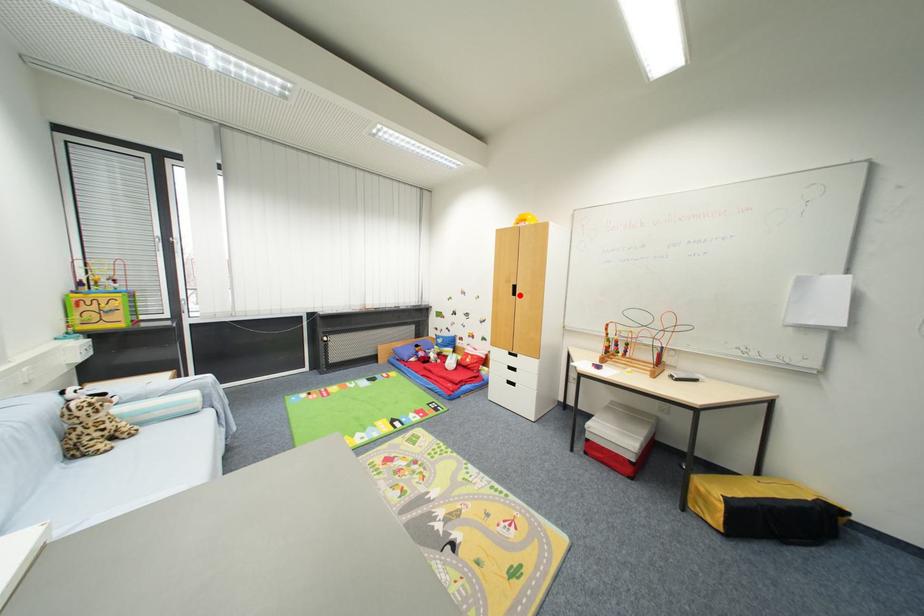
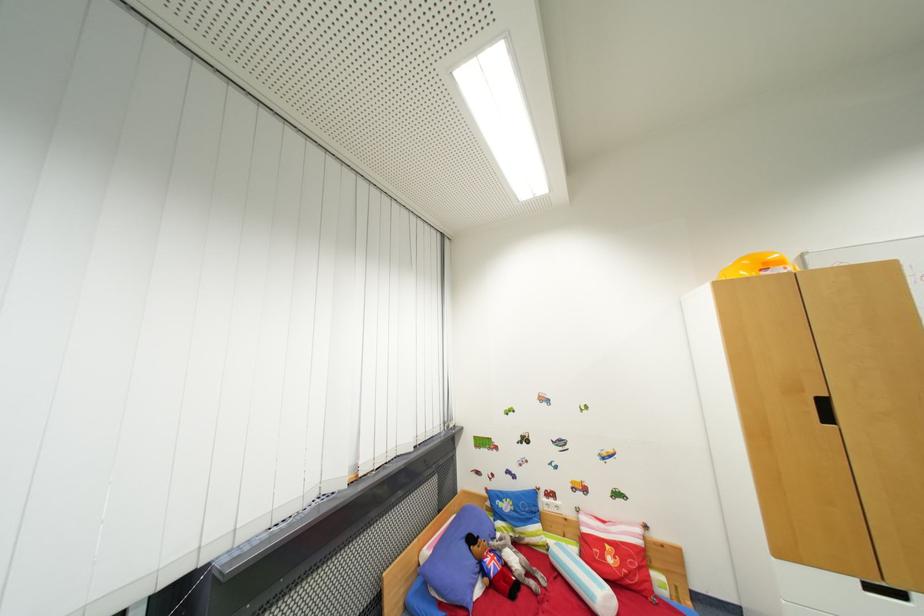
Where in the second image is the point corresponding to the highlighted location from the first image?

(833, 419)